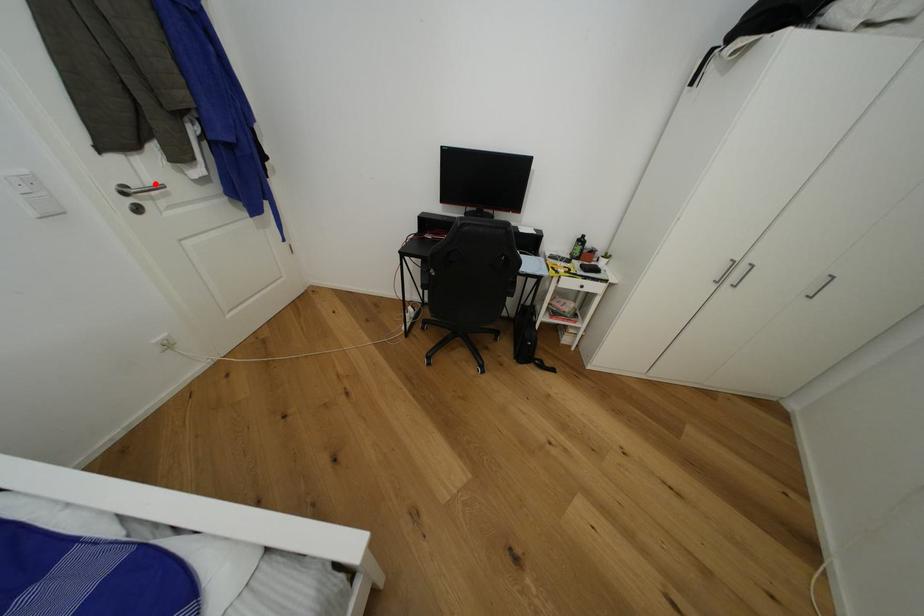
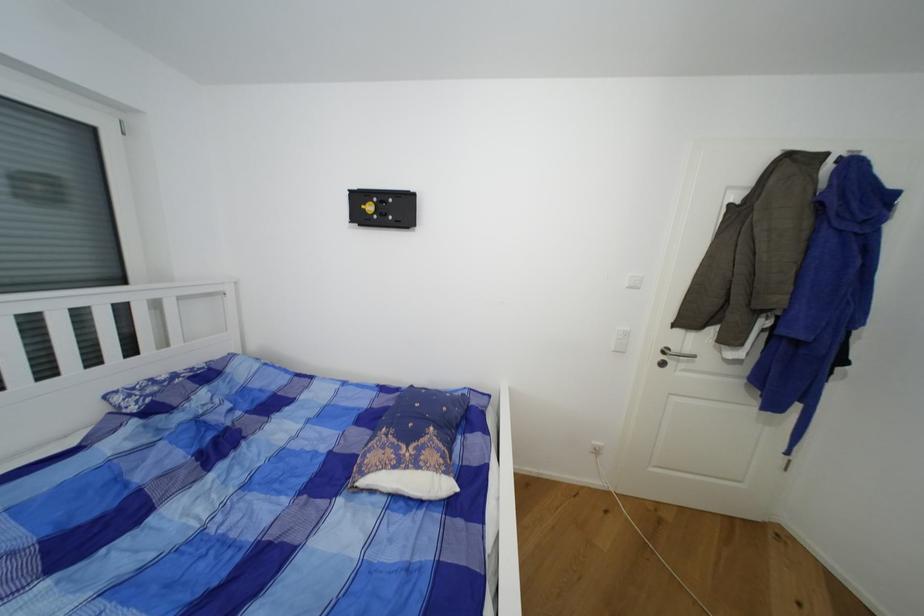
The point at the highlighted location is marked in the first image. Where is the corresponding point in the second image?

(691, 352)